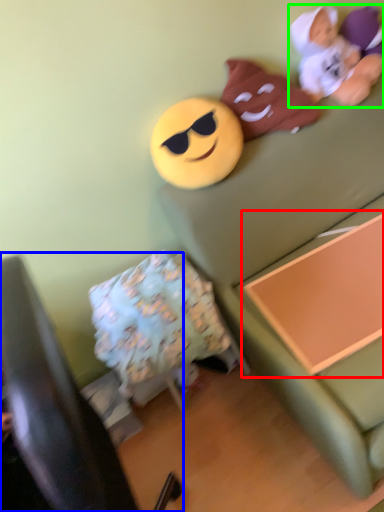
Question: Considering the real-world distances, which object is farthest from changing table (highlighted by a red box)? furniture (highlighted by a blue box) or toy (highlighted by a green box)?

Choices:
 (A) furniture
 (B) toy

Answer: (A)